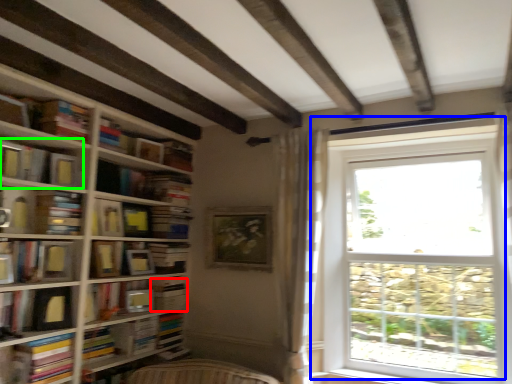
Question: Which is nearer to the paperback book (highlighted by a red box)? window (highlighted by a blue box) or book (highlighted by a green box).

Choices:
 (A) window
 (B) book

Answer: (B)